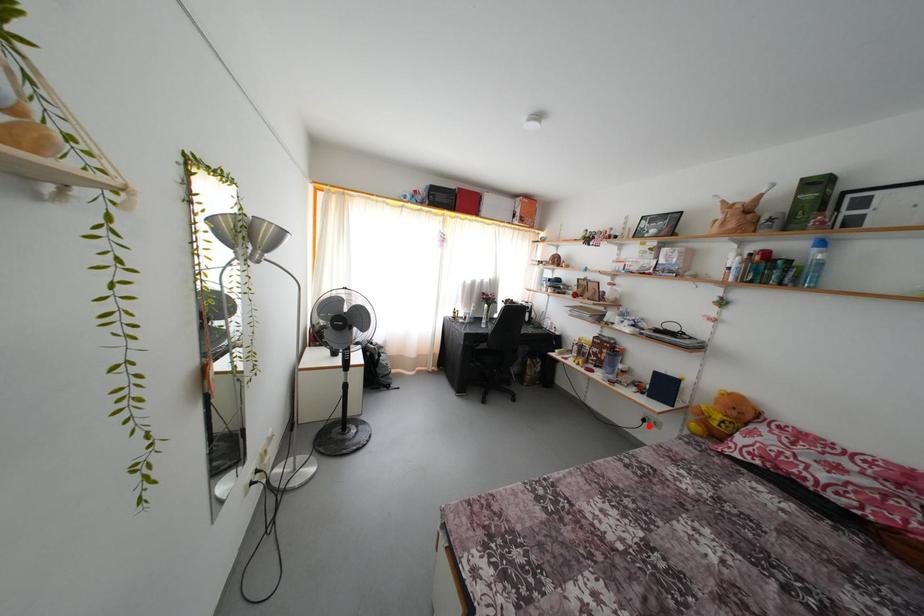
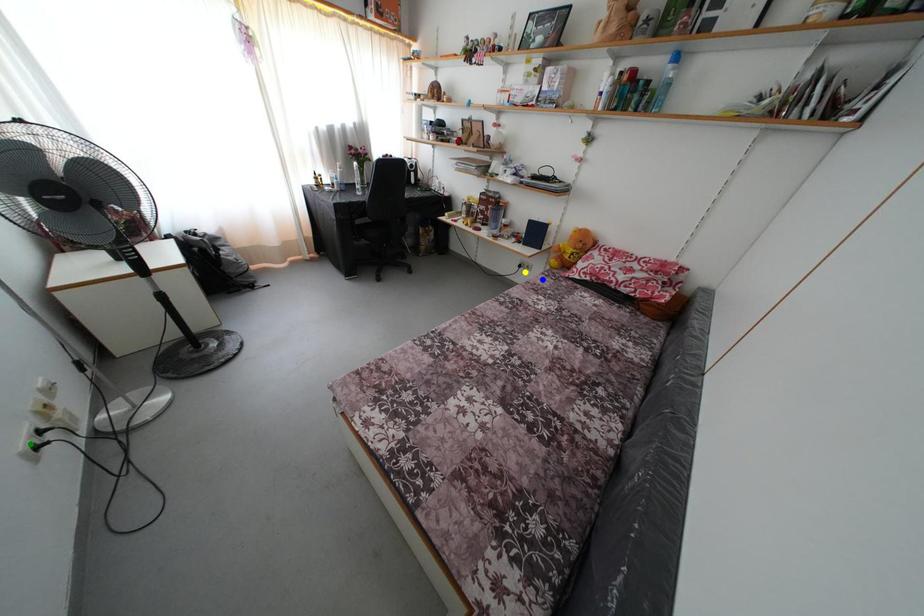
Question: I am providing you with two images of the same scene from different viewpoints. A red point is marked on the first image. You are given multiple points on the second image. Can you choose the point in image 2 that corresponds to the point in image 1?

Choices:
 (A) yellow point
 (B) green point
 (C) blue point

Answer: (A)